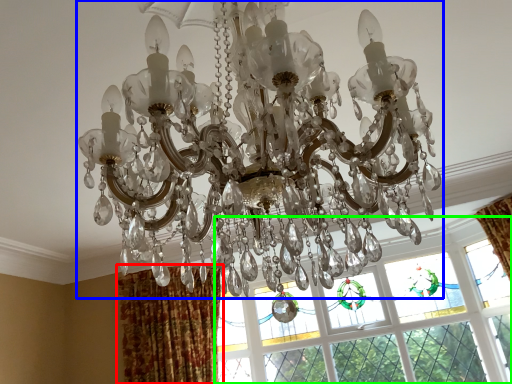
Question: Based on their relative distances, which object is nearer to curtain (highlighted by a red box)? Choose from lamp (highlighted by a blue box) and window (highlighted by a green box).

Choices:
 (A) lamp
 (B) window

Answer: (B)